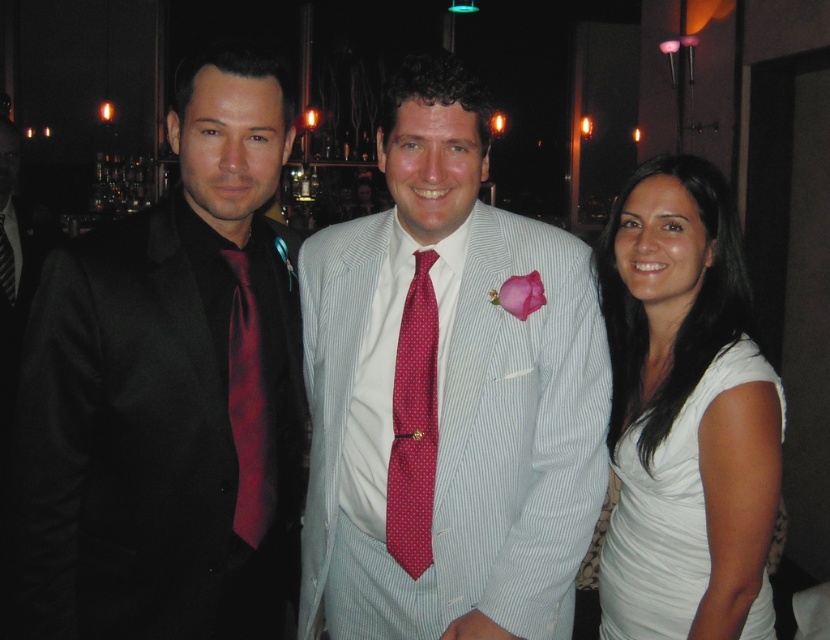
Question: Among these objects, which one is farthest from the camera?

Choices:
 (A) red dotted tie at center
 (B) black silk tie at left
 (C) matte black suit at left
 (D) white satin dress at right

Answer: (B)

Question: Can you confirm if matte black suit at left is positioned to the right of white satin dress at right?

Choices:
 (A) no
 (B) yes

Answer: (A)

Question: From the image, what is the correct spatial relationship of matte black suit at left in relation to white satin dress at right?

Choices:
 (A) right
 (B) left

Answer: (B)

Question: Which object is farther from the camera taking this photo?

Choices:
 (A) white satin dress at right
 (B) light blue striped suit at center

Answer: (A)

Question: Is matte black suit at left below red dotted tie at center?

Choices:
 (A) yes
 (B) no

Answer: (B)

Question: Which point appears closest to the camera in this image?

Choices:
 (A) (10, 292)
 (B) (252, 371)

Answer: (B)